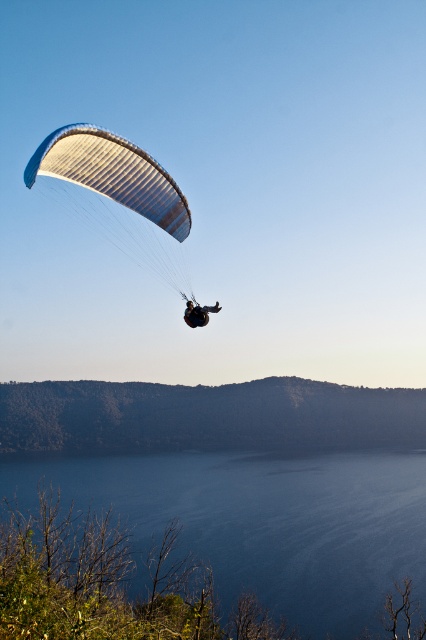
Does point (229, 586) come farther from viewer compared to point (210, 305)?

Yes, point (229, 586) is behind point (210, 305).

Is point (339, 452) in front of point (198, 321)?

No.

Locate an element on the screen. blue smooth water at center is located at coordinates (267, 522).

Is blue smooth water at center bigger than brown textured hillside at lower center?

Actually, blue smooth water at center might be smaller than brown textured hillside at lower center.

Can you confirm if blue smooth water at center is smaller than brown textured hillside at lower center?

Yes, blue smooth water at center is smaller than brown textured hillside at lower center.

Does point (359, 630) lie behind point (192, 408)?

No.

This screenshot has height=640, width=426. I want to click on blue smooth water at center, so click(267, 522).

Measure the distance between blue smooth water at center and matte blue parachute at upper left.

blue smooth water at center is 136.97 feet away from matte blue parachute at upper left.

Does blue smooth water at center appear under matte blue parachute at upper left?

Correct, blue smooth water at center is located below matte blue parachute at upper left.

Image resolution: width=426 pixels, height=640 pixels. I want to click on blue smooth water at center, so click(267, 522).

Find the location of a particular element. The height and width of the screenshot is (640, 426). blue smooth water at center is located at coordinates (267, 522).